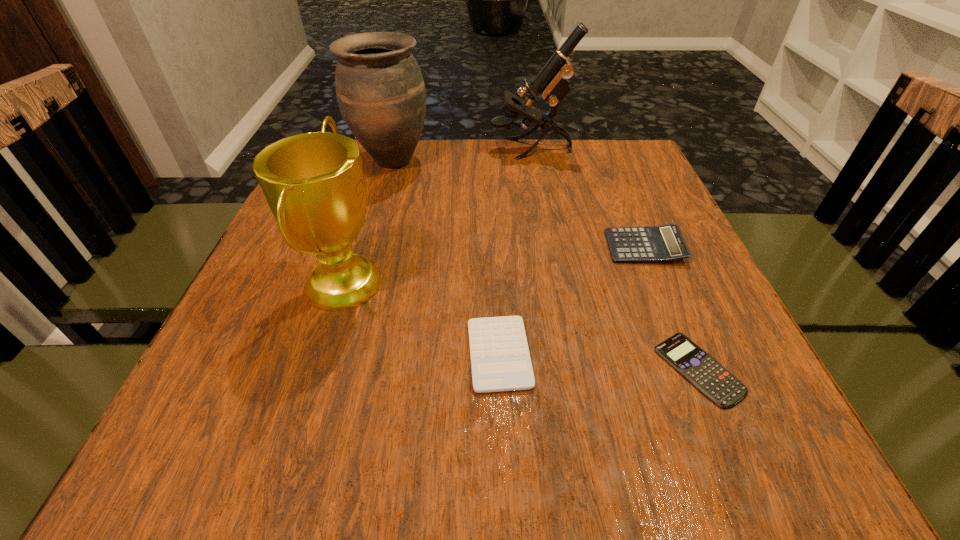
At what (x,y) coordinates should I click in order to perform the action: click on vacant space that's between the urn and the award. Please return your answer as a coordinate pair (x, y). The height and width of the screenshot is (540, 960). Looking at the image, I should click on (369, 221).

You are a GUI agent. You are given a task and a screenshot of the screen. Output one action in this format:
    pyautogui.click(x=<x>, y=<y>)
    Task: Click on the free space between the tallest calculator and the shortest calculator
    
    Given the screenshot: What is the action you would take?
    pyautogui.click(x=671, y=308)

The width and height of the screenshot is (960, 540). Find the location of `blank region between the award and the microscope`. blank region between the award and the microscope is located at coordinates (438, 215).

I want to click on free space between the award and the microscope, so click(x=438, y=215).

At what (x,y) coordinates should I click in order to perform the action: click on free space that is in between the tallest calculator and the shortest object. Please return your answer as a coordinate pair (x, y). The image size is (960, 540). Looking at the image, I should click on (671, 308).

Find the location of a particular element. Image resolution: width=960 pixels, height=540 pixels. object that can be found as the closest to the shortest object is located at coordinates (663, 243).

Select which object is the closest to the microscope. Please provide its 2D coordinates. Your answer should be formatted as a tuple, i.e. [(x, y)], where the tuple contains the x and y coordinates of a point satisfying the conditions above.

[(381, 94)]

The height and width of the screenshot is (540, 960). In order to click on calculator that is the second closest one to the award in this screenshot , I will do `click(663, 243)`.

Image resolution: width=960 pixels, height=540 pixels. Identify the location of calculator identified as the second closest to the second shortest calculator. (663, 243).

At what (x,y) coordinates should I click in order to perform the action: click on blank space that satisfies the following two spatial constraints: 1. on the shiny surface of the award; 2. on the left side of the shortest object. Please return your answer as a coordinate pair (x, y). Image resolution: width=960 pixels, height=540 pixels. Looking at the image, I should click on (317, 369).